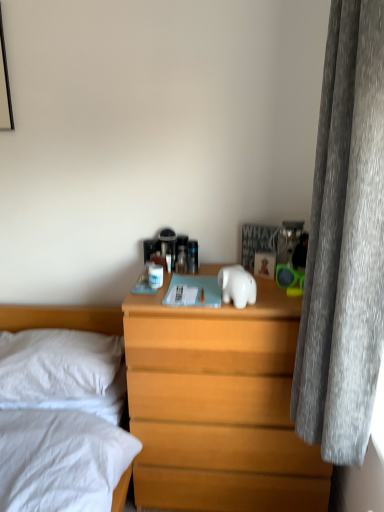
Question: Is white glossy elephant at center bigger than gray velvet curtain at right?

Choices:
 (A) yes
 (B) no

Answer: (B)

Question: Would you say white glossy elephant at center is a long distance from gray velvet curtain at right?

Choices:
 (A) yes
 (B) no

Answer: (B)

Question: Can you see white glossy elephant at center touching gray velvet curtain at right?

Choices:
 (A) yes
 (B) no

Answer: (B)

Question: From a real-world perspective, is white glossy elephant at center over gray velvet curtain at right?

Choices:
 (A) no
 (B) yes

Answer: (A)

Question: Does white glossy elephant at center contain gray velvet curtain at right?

Choices:
 (A) no
 (B) yes

Answer: (A)

Question: From the image's perspective, is wooden nightstand at center positioned above or below gray velvet curtain at right?

Choices:
 (A) above
 (B) below

Answer: (B)

Question: In the image, is wooden nightstand at center positioned in front of or behind gray velvet curtain at right?

Choices:
 (A) front
 (B) behind

Answer: (B)

Question: From a real-world perspective, is wooden nightstand at center above or below gray velvet curtain at right?

Choices:
 (A) below
 (B) above

Answer: (A)

Question: Considering the positions of wooden nightstand at center and gray velvet curtain at right in the image, is wooden nightstand at center wider or thinner than gray velvet curtain at right?

Choices:
 (A) wide
 (B) thin

Answer: (A)

Question: Considering the positions of gray velvet curtain at right and white soft pillow at left in the image, is gray velvet curtain at right wider or thinner than white soft pillow at left?

Choices:
 (A) thin
 (B) wide

Answer: (A)

Question: From the image's perspective, is gray velvet curtain at right positioned above or below white soft pillow at left?

Choices:
 (A) above
 (B) below

Answer: (A)

Question: Is gray velvet curtain at right inside the boundaries of white soft pillow at left, or outside?

Choices:
 (A) inside
 (B) outside

Answer: (B)

Question: Is gray velvet curtain at right bigger or smaller than white soft pillow at left?

Choices:
 (A) big
 (B) small

Answer: (A)

Question: From the image's perspective, relative to wooden nightstand at center, is white glossy elephant at center above or below?

Choices:
 (A) above
 (B) below

Answer: (A)

Question: From a real-world perspective, is white glossy elephant at center positioned above or below wooden nightstand at center?

Choices:
 (A) below
 (B) above

Answer: (B)